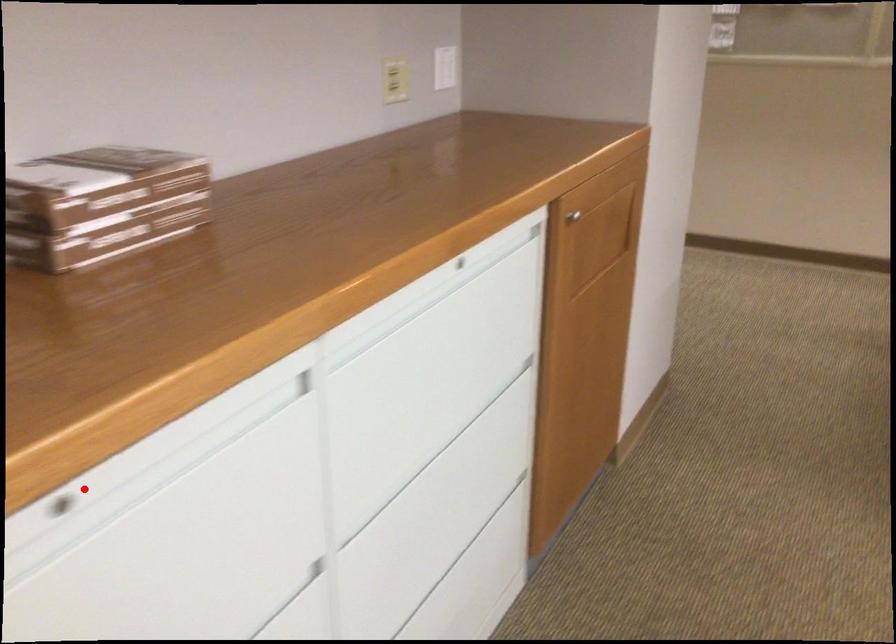
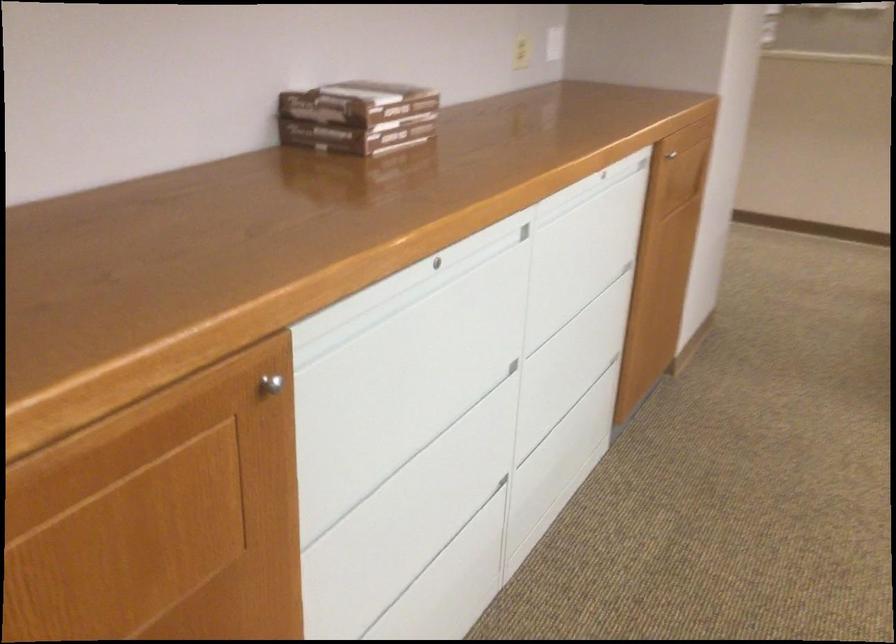
Where in the second image is the point corresponding to the highlighted location from the first image?

(435, 261)